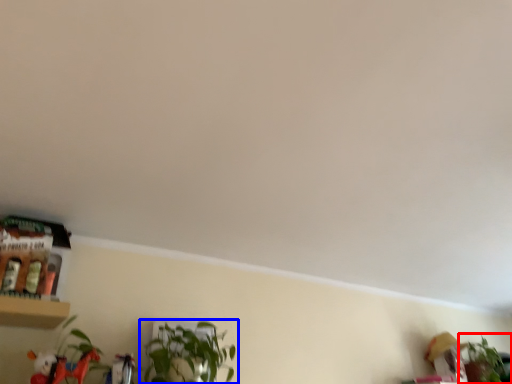
Question: Which object is closer to the camera taking this photo, houseplant (highlighted by a red box) or houseplant (highlighted by a blue box)?

Choices:
 (A) houseplant
 (B) houseplant

Answer: (B)